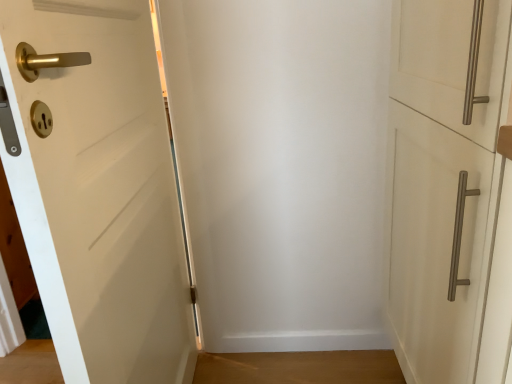
What do you see at coordinates (443, 180) in the screenshot? This screenshot has width=512, height=384. I see `white matte cabinet handle at right, positioned as the second door in left-to-right order` at bounding box center [443, 180].

This screenshot has width=512, height=384. Identify the location of white matte cabinet handle at right, positioned as the first door in right-to-left order. (443, 180).

Where is `white matte door at left, the 2th door viewed from the right`? The width and height of the screenshot is (512, 384). white matte door at left, the 2th door viewed from the right is located at coordinates (99, 192).

Describe the element at coordinates (99, 192) in the screenshot. I see `white matte door at left, the 2th door viewed from the right` at that location.

At what (x,y) coordinates should I click in order to perform the action: click on white matte cabinet handle at right, positioned as the first door in right-to-left order. Please return your answer as a coordinate pair (x, y). The image size is (512, 384). Looking at the image, I should click on (443, 180).

Is white matte cabinet handle at right, positioned as the first door in right-to-left order, to the left or to the right of white matte door at left, the 2th door viewed from the right, in the image?

From the image, it's evident that white matte cabinet handle at right, positioned as the first door in right-to-left order, is to the right of white matte door at left, the 2th door viewed from the right.

Which object is closer to the camera taking this photo, white matte cabinet handle at right, positioned as the first door in right-to-left order, or white matte door at left, the 1th door positioned from the left?

white matte door at left, the 1th door positioned from the left.

Considering the points (480, 191) and (126, 289), which point is behind, point (480, 191) or point (126, 289)?

Point (126, 289)

From the image's perspective, is white matte cabinet handle at right, positioned as the second door in left-to-right order, on white matte door at left, the 2th door viewed from the right?

Yes, from the image's perspective, white matte cabinet handle at right, positioned as the second door in left-to-right order, is on top of white matte door at left, the 2th door viewed from the right.

From a real-world perspective, is white matte cabinet handle at right, positioned as the first door in right-to-left order, below white matte door at left, the 2th door viewed from the right?

Yes, from a real-world perspective, white matte cabinet handle at right, positioned as the first door in right-to-left order, is below white matte door at left, the 2th door viewed from the right.

From the picture: Is white matte cabinet handle at right, positioned as the first door in right-to-left order, wider than white matte door at left, the 2th door viewed from the right?

Indeed, white matte cabinet handle at right, positioned as the first door in right-to-left order, has a greater width compared to white matte door at left, the 2th door viewed from the right.

Which of these two, white matte cabinet handle at right, positioned as the second door in left-to-right order, or white matte door at left, the 2th door viewed from the right, stands shorter?

With less height is white matte cabinet handle at right, positioned as the second door in left-to-right order.

Is white matte cabinet handle at right, positioned as the second door in left-to-right order, smaller than white matte door at left, the 2th door viewed from the right?

Actually, white matte cabinet handle at right, positioned as the second door in left-to-right order, might be larger than white matte door at left, the 2th door viewed from the right.

Choose the correct answer: Is white matte cabinet handle at right, positioned as the first door in right-to-left order, inside white matte door at left, the 2th door viewed from the right, or outside it?

white matte cabinet handle at right, positioned as the first door in right-to-left order, cannot be found inside white matte door at left, the 2th door viewed from the right.

Is white matte cabinet handle at right, positioned as the second door in left-to-right order, not near white matte door at left, the 2th door viewed from the right?

They are positioned close to each other.

From the picture: Is white matte cabinet handle at right, positioned as the first door in right-to-left order, facing away from white matte door at left, the 2th door viewed from the right?

No.

How different are the orientations of white matte cabinet handle at right, positioned as the first door in right-to-left order, and white matte door at left, the 1th door positioned from the left, in degrees?

The facing directions of white matte cabinet handle at right, positioned as the first door in right-to-left order, and white matte door at left, the 1th door positioned from the left, are 0.77 degrees apart.

Locate an element on the screen. door that appears on the right of white matte door at left, the 1th door positioned from the left is located at coordinates point(443,180).

Considering the relative positions of white matte door at left, the 1th door positioned from the left, and white matte cabinet handle at right, positioned as the first door in right-to-left order, in the image provided, is white matte door at left, the 1th door positioned from the left, to the right of white matte cabinet handle at right, positioned as the first door in right-to-left order, from the viewer's perspective?

Incorrect, white matte door at left, the 1th door positioned from the left, is not on the right side of white matte cabinet handle at right, positioned as the first door in right-to-left order.

Which object is further away from the camera taking this photo, white matte door at left, the 2th door viewed from the right, or white matte cabinet handle at right, positioned as the first door in right-to-left order?

white matte cabinet handle at right, positioned as the first door in right-to-left order, is more distant.

Which is nearer, (116, 247) or (485, 279)?

The point (485, 279) is closer to the camera.

From the picture: From the image's perspective, does white matte door at left, the 1th door positioned from the left, appear higher than white matte cabinet handle at right, positioned as the second door in left-to-right order?

Actually, white matte door at left, the 1th door positioned from the left, appears below white matte cabinet handle at right, positioned as the second door in left-to-right order, in the image.

From a real-world perspective, who is located higher, white matte door at left, the 2th door viewed from the right, or white matte cabinet handle at right, positioned as the second door in left-to-right order?

white matte door at left, the 2th door viewed from the right, from a real-world perspective.

Considering the relative sizes of white matte door at left, the 1th door positioned from the left, and white matte cabinet handle at right, positioned as the second door in left-to-right order, in the image provided, is white matte door at left, the 1th door positioned from the left, thinner than white matte cabinet handle at right, positioned as the second door in left-to-right order,?

Correct, the width of white matte door at left, the 1th door positioned from the left, is less than that of white matte cabinet handle at right, positioned as the second door in left-to-right order.

Does white matte door at left, the 2th door viewed from the right, have a greater height compared to white matte cabinet handle at right, positioned as the second door in left-to-right order?

Yes.

Which of these two, white matte door at left, the 2th door viewed from the right, or white matte cabinet handle at right, positioned as the second door in left-to-right order, is bigger?

white matte cabinet handle at right, positioned as the second door in left-to-right order, is bigger.

Is white matte door at left, the 1th door positioned from the left, outside of white matte cabinet handle at right, positioned as the second door in left-to-right order?

Yes, white matte door at left, the 1th door positioned from the left, is outside of white matte cabinet handle at right, positioned as the second door in left-to-right order.

Would you say white matte door at left, the 1th door positioned from the left, is a long distance from white matte cabinet handle at right, positioned as the second door in left-to-right order?

No, there isn't a large distance between white matte door at left, the 1th door positioned from the left, and white matte cabinet handle at right, positioned as the second door in left-to-right order.

Is white matte door at left, the 1th door positioned from the left, aimed at white matte cabinet handle at right, positioned as the second door in left-to-right order?

Yes, white matte door at left, the 1th door positioned from the left, faces towards white matte cabinet handle at right, positioned as the second door in left-to-right order.

What's the angular difference between white matte door at left, the 1th door positioned from the left, and white matte cabinet handle at right, positioned as the second door in left-to-right order,'s facing directions?

The angular difference between white matte door at left, the 1th door positioned from the left, and white matte cabinet handle at right, positioned as the second door in left-to-right order, is 0.77 degrees.

How much distance is there between white matte door at left, the 2th door viewed from the right, and white matte cabinet handle at right, positioned as the second door in left-to-right order?

white matte door at left, the 2th door viewed from the right, and white matte cabinet handle at right, positioned as the second door in left-to-right order, are 24.88 inches apart from each other.

Find the location of a particular element. door that is below the white matte cabinet handle at right, positioned as the second door in left-to-right order (from the image's perspective) is located at coordinates (99, 192).

Image resolution: width=512 pixels, height=384 pixels. I want to click on door above the white matte cabinet handle at right, positioned as the first door in right-to-left order (from a real-world perspective), so click(x=99, y=192).

The image size is (512, 384). I want to click on door below the white matte cabinet handle at right, positioned as the first door in right-to-left order (from the image's perspective), so click(x=99, y=192).